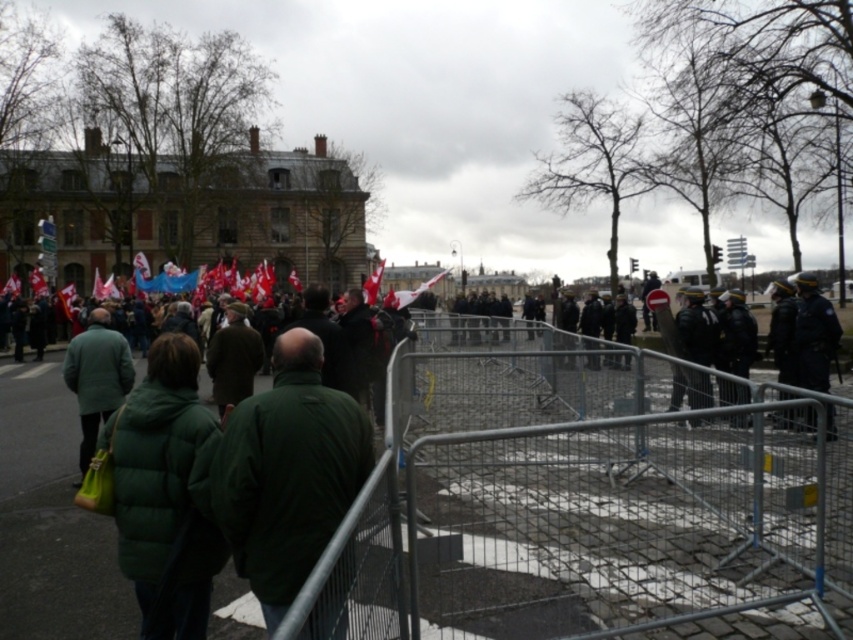
Question: Which object is the closest to the metallic silver fence at center?

Choices:
 (A) green matte jacket at left
 (B) green matte jacket at center
 (C) green puffy coat at center

Answer: (B)

Question: Can you confirm if green puffy coat at center is bigger than green matte jacket at left?

Choices:
 (A) no
 (B) yes

Answer: (A)

Question: Does metallic silver fence at center have a lesser width compared to green puffy coat at center?

Choices:
 (A) no
 (B) yes

Answer: (A)

Question: Is metallic silver fence at center wider than green matte jacket at center?

Choices:
 (A) no
 (B) yes

Answer: (B)

Question: Based on their relative distances, which object is nearer to the green puffy coat at center?

Choices:
 (A) green matte jacket at center
 (B) green matte jacket at left
 (C) metallic silver fence at center

Answer: (A)

Question: Which point is closer to the camera?

Choices:
 (A) green matte jacket at left
 (B) green matte jacket at center
 (C) metallic silver fence at center
 (D) green puffy coat at center

Answer: (C)